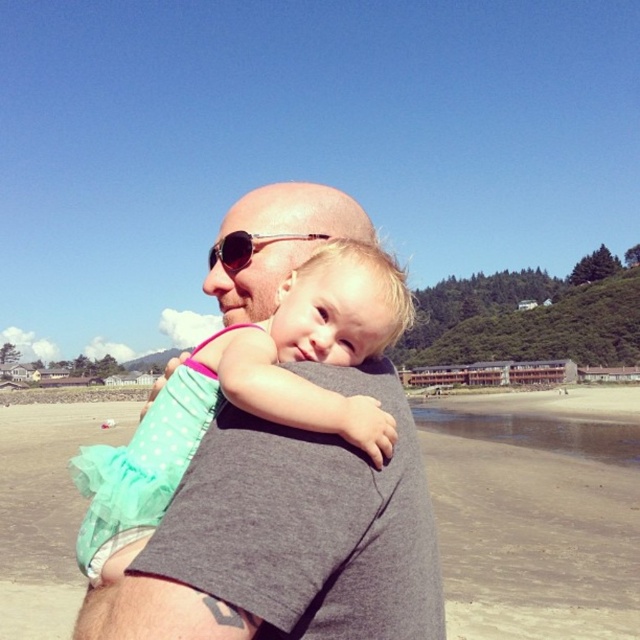
Question: Does smooth sand at center have a larger size compared to metallic gold sunglasses at center?

Choices:
 (A) yes
 (B) no

Answer: (A)

Question: Does smooth sand at center have a lesser width compared to metallic gold sunglasses at center?

Choices:
 (A) yes
 (B) no

Answer: (B)

Question: Estimate the real-world distances between objects in this image. Which object is farther from the smooth sand at center?

Choices:
 (A) metallic gold sunglasses at center
 (B) gray cotton shirt at center

Answer: (A)

Question: Can you confirm if smooth sand at center is positioned below metallic gold sunglasses at center?

Choices:
 (A) yes
 (B) no

Answer: (A)

Question: Estimate the real-world distances between objects in this image. Which object is closer to the metallic gold sunglasses at center?

Choices:
 (A) gray cotton shirt at center
 (B) smooth sand at center

Answer: (A)

Question: Which object appears closest to the camera in this image?

Choices:
 (A) metallic gold sunglasses at center
 (B) gray cotton shirt at center
 (C) smooth sand at center

Answer: (B)